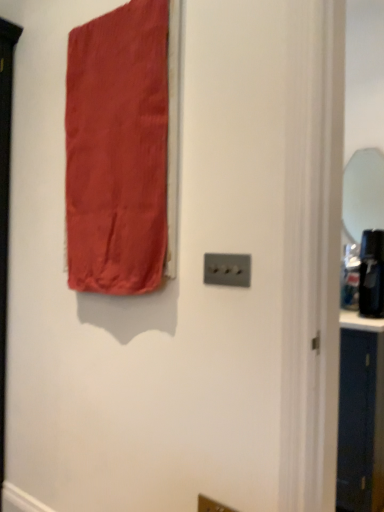
Identify the location of clear glass mirror at right. (363, 193).

Locate an element on the screen. This screenshot has width=384, height=512. satin silver light switch at center is located at coordinates (227, 269).

Locate an element on the screen. clear glass mirror at right is located at coordinates (363, 193).

In terms of size, does satin silver light switch at center appear bigger or smaller than satin red curtain at upper left?

Considering their sizes, satin silver light switch at center takes up less space than satin red curtain at upper left.

Which object is positioned more to the left, satin silver light switch at center or satin red curtain at upper left?

satin red curtain at upper left is more to the left.

Is satin silver light switch at center positioned far away from satin red curtain at upper left?

satin silver light switch at center is actually quite close to satin red curtain at upper left.

How many degrees apart are the facing directions of satin silver light switch at center and satin red curtain at upper left?

There is a 1.36-degree angle between the facing directions of satin silver light switch at center and satin red curtain at upper left.

Is clear glass mirror at right inside satin silver light switch at center?

Definitely not — clear glass mirror at right is not inside satin silver light switch at center.

From a real-world perspective, which is physically above, satin silver light switch at center or clear glass mirror at right?

clear glass mirror at right, from a real-world perspective.

Considering the positions of objects satin silver light switch at center and clear glass mirror at right in the image provided, who is more to the left, satin silver light switch at center or clear glass mirror at right?

Positioned to the left is satin silver light switch at center.

Considering the relative sizes of satin red curtain at upper left and clear glass mirror at right in the image provided, is satin red curtain at upper left smaller than clear glass mirror at right?

No.

Would you say satin red curtain at upper left is outside clear glass mirror at right?

That's correct, satin red curtain at upper left is outside of clear glass mirror at right.

Is satin red curtain at upper left facing towards clear glass mirror at right?

No, satin red curtain at upper left is not turned towards clear glass mirror at right.

From a real-world perspective, is satin red curtain at upper left physically above clear glass mirror at right?

No, from a real-world perspective, satin red curtain at upper left is not over clear glass mirror at right

Are satin red curtain at upper left and satin silver light switch at center making contact?

They are not placed beside each other.

In the scene shown: Could you tell me if satin red curtain at upper left is facing satin silver light switch at center?

No, satin red curtain at upper left does not turn towards satin silver light switch at center.

From the image's perspective, is satin red curtain at upper left below satin silver light switch at center?

No, from the image's perspective, satin red curtain at upper left is not beneath satin silver light switch at center.

How many degrees apart are the facing directions of satin red curtain at upper left and satin silver light switch at center?

There is a 1.36-degree angle between the facing directions of satin red curtain at upper left and satin silver light switch at center.

What's the angular difference between clear glass mirror at right and satin silver light switch at center's facing directions?

clear glass mirror at right and satin silver light switch at center are facing 0.739 degrees away from each other.

Consider the image. Is clear glass mirror at right surrounding satin silver light switch at center?

No, satin silver light switch at center is not inside clear glass mirror at right.

Is the depth of clear glass mirror at right greater than that of satin silver light switch at center?

Yes, the depth of clear glass mirror at right is greater than that of satin silver light switch at center.

Considering the relative sizes of clear glass mirror at right and satin silver light switch at center in the image provided, is clear glass mirror at right bigger than satin silver light switch at center?

Indeed, clear glass mirror at right has a larger size compared to satin silver light switch at center.

Is clear glass mirror at right looking in the opposite direction of satin red curtain at upper left?

That's not correct — clear glass mirror at right is not looking away from satin red curtain at upper left.

Which of these two, clear glass mirror at right or satin red curtain at upper left, is thinner?

Thinner between the two is clear glass mirror at right.

Is point (368, 197) farther from camera compared to point (89, 237)?

Yes, it is behind point (89, 237).

Can you tell me how much clear glass mirror at right and satin red curtain at upper left differ in facing direction?

2.1 degrees.

In the image, there is a satin red curtain at upper left. At what (x,y) coordinates should I click in order to perform the action: click on light switch below it (from the image's perspective). Please return your answer as a coordinate pair (x, y). Image resolution: width=384 pixels, height=512 pixels. Looking at the image, I should click on (227, 269).

The image size is (384, 512). I want to click on light switch in front of the clear glass mirror at right, so click(x=227, y=269).

Based on their spatial positions, is clear glass mirror at right or satin red curtain at upper left closer to satin silver light switch at center?

Among the two, satin red curtain at upper left is located nearer to satin silver light switch at center.

Which object lies nearer to the anchor point satin red curtain at upper left, clear glass mirror at right or satin silver light switch at center?

satin silver light switch at center is positioned closer to the anchor satin red curtain at upper left.

From the image, which object appears to be farther from satin red curtain at upper left, satin silver light switch at center or clear glass mirror at right?

clear glass mirror at right lies further to satin red curtain at upper left than the other object.

Based on the photo, looking at the image, which one is located closer to clear glass mirror at right, satin red curtain at upper left or satin silver light switch at center?

satin red curtain at upper left is closer to clear glass mirror at right.

Estimate the real-world distances between objects in this image. Which object is closer to clear glass mirror at right, satin silver light switch at center or satin red curtain at upper left?

Based on the image, satin red curtain at upper left appears to be nearer to clear glass mirror at right.

Which object lies further to the anchor point satin silver light switch at center, satin red curtain at upper left or clear glass mirror at right?

clear glass mirror at right.

Image resolution: width=384 pixels, height=512 pixels. What are the coordinates of `curtain between satin silver light switch at center and clear glass mirror at right along the z-axis` in the screenshot? It's located at (117, 150).